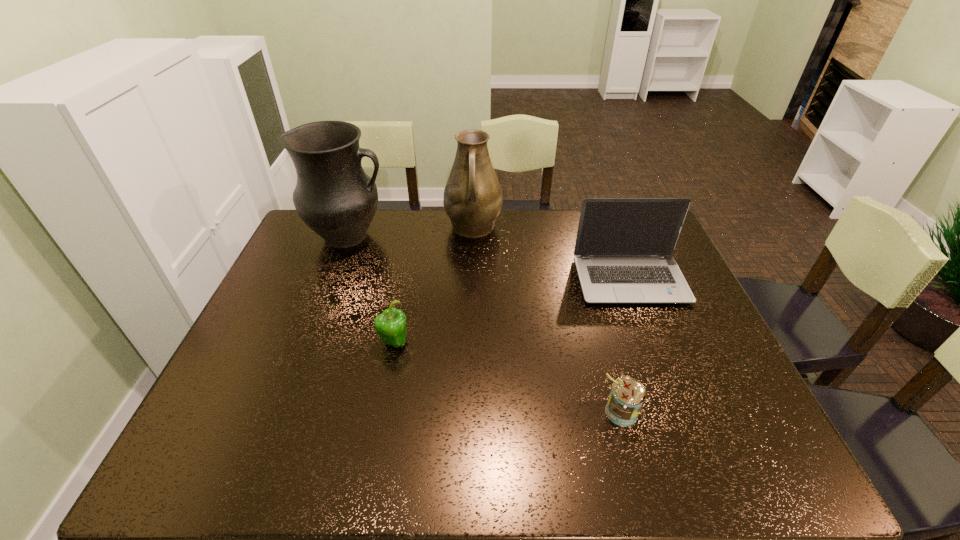
Find the location of a particular element. vacant space situated 0.170m on the right of the can is located at coordinates (717, 411).

What are the coordinates of `object positioned at the left edge` in the screenshot? It's located at [x=333, y=196].

Find the location of a particular element. object that is at the right edge is located at coordinates (623, 252).

I want to click on object present at the far left corner, so click(333, 196).

Identify the location of vacant area at the far edge. point(482,247).

Identify the location of vacant region at the near edge of the desktop. (343, 438).

In the image, there is a desktop. Where is `free space at the left edge`? This screenshot has width=960, height=540. free space at the left edge is located at coordinates (263, 362).

The image size is (960, 540). I want to click on vacant space at the right edge of the desktop, so click(x=684, y=353).

This screenshot has height=540, width=960. Find the location of `free space at the far left corner`. free space at the far left corner is located at coordinates (300, 235).

You are a GUI agent. You are given a task and a screenshot of the screen. Output one action in this format:
    pyautogui.click(x=<x>, y=<y>)
    Task: Click on the vacant space at the near right corner
    This screenshot has height=540, width=960.
    Given the screenshot: What is the action you would take?
    pyautogui.click(x=763, y=469)